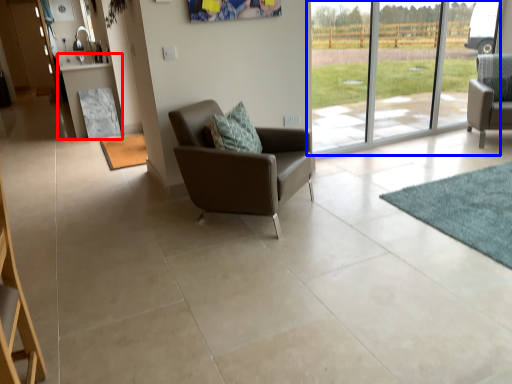
Question: Among these objects, which one is farthest to the camera, table (highlighted by a red box) or window (highlighted by a blue box)?

Choices:
 (A) table
 (B) window

Answer: (A)